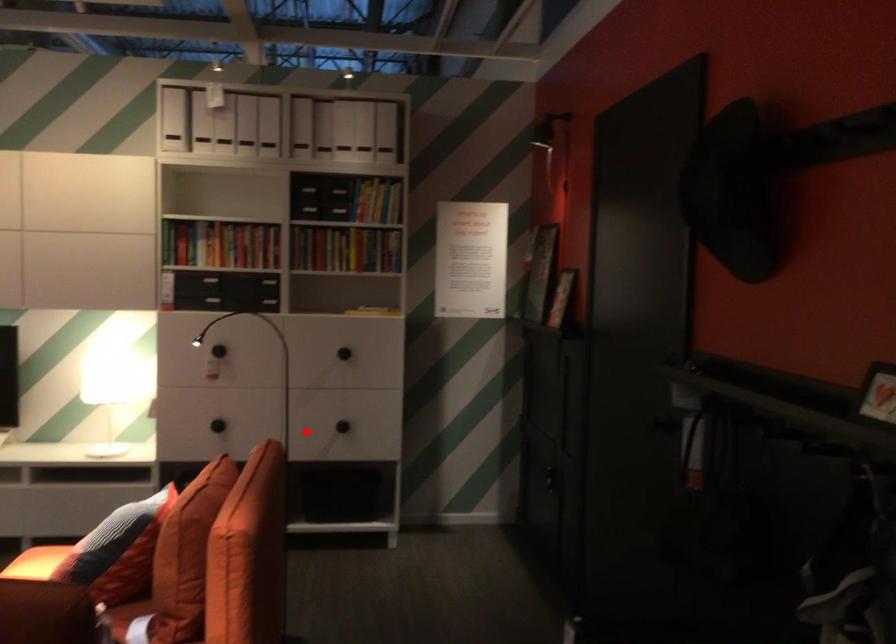
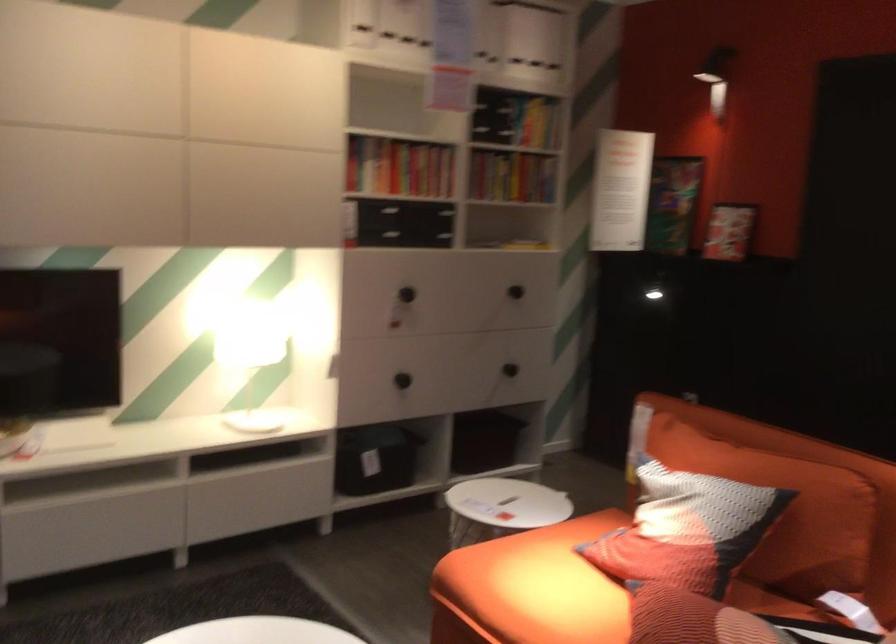
Where in the second image is the point corresponding to the highlighted location from the first image?

(510, 368)